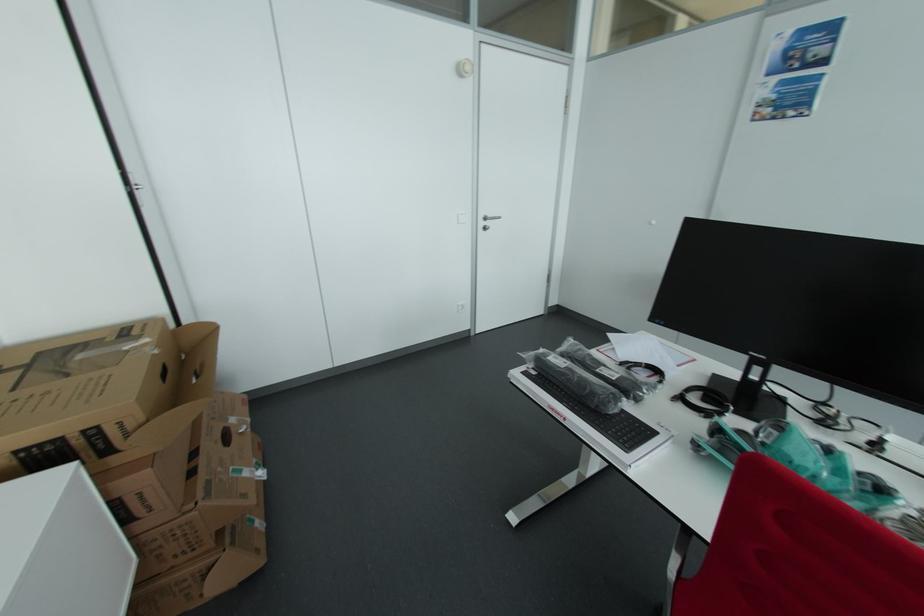
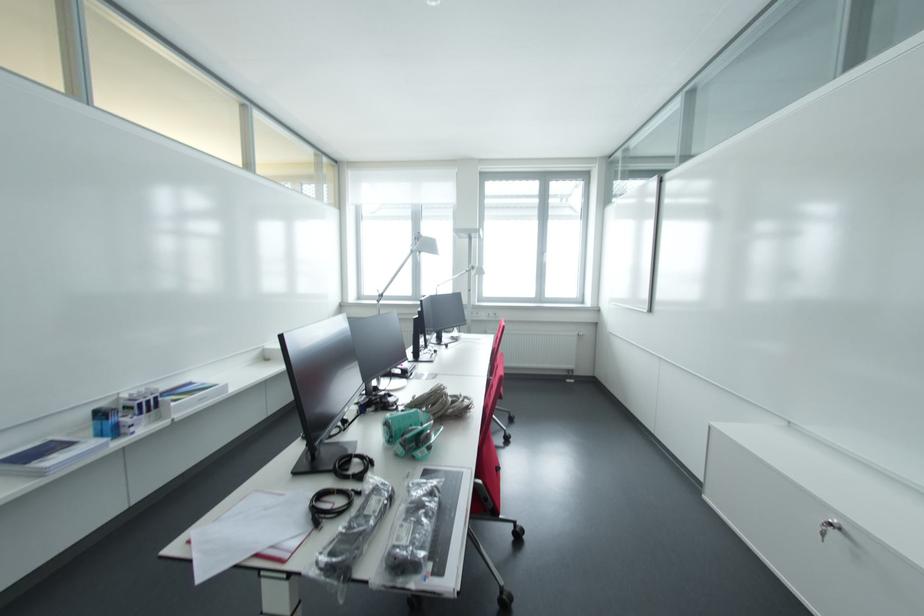
Locate, in the second image, the point that corresponds to point (601, 371) in the first image.

(380, 516)